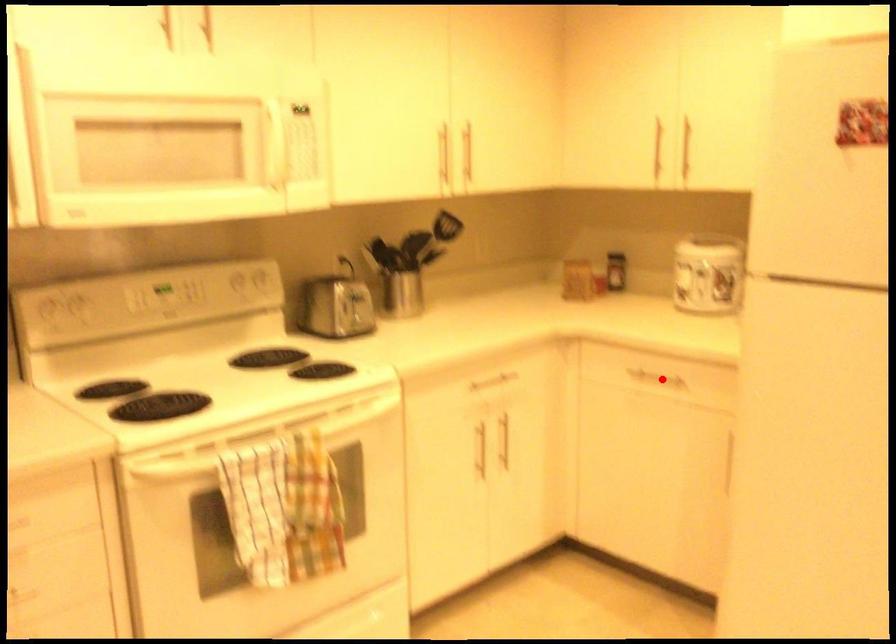
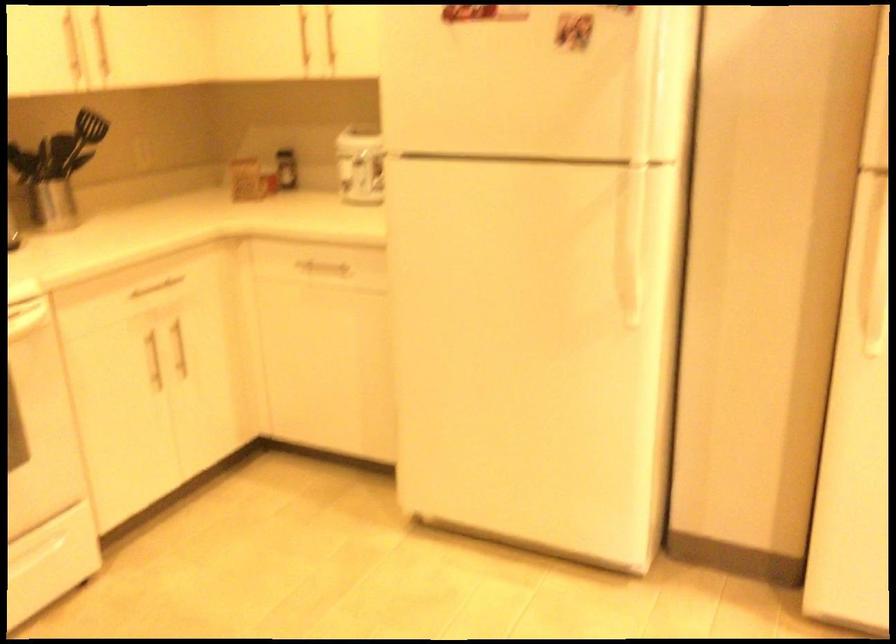
Where in the second image is the point corresponding to the highlighted location from the first image?

(323, 268)